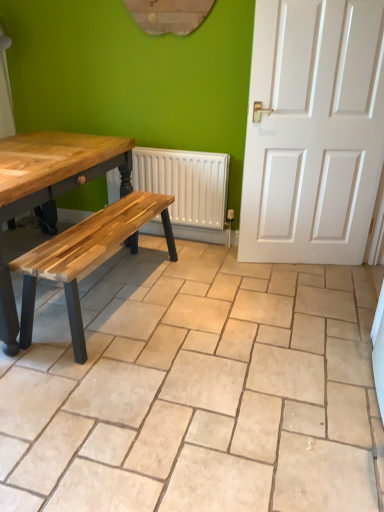
Locate an element on the screen. This screenshot has height=512, width=384. vacant space situated above beige ceramic tile at center (from a real-world perspective) is located at coordinates (192, 367).